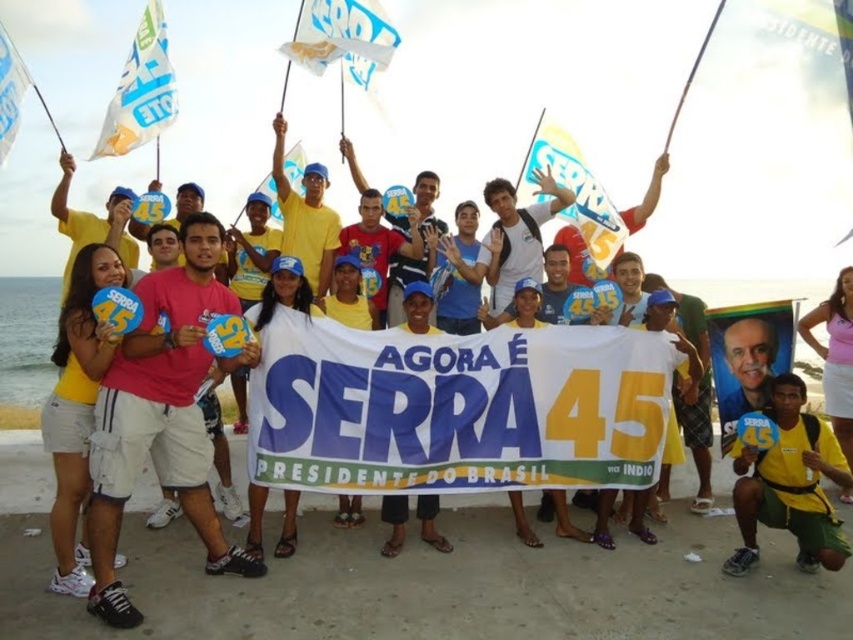
Can you confirm if yellow fabric shirt at center is thinner than white paper flag at upper left?

Incorrect, yellow fabric shirt at center's width is not less than white paper flag at upper left's.

Measure the distance between yellow fabric shirt at center and camera.

yellow fabric shirt at center and camera are 6.58 meters apart from each other.

Locate an element on the screen. Image resolution: width=853 pixels, height=640 pixels. yellow fabric shirt at center is located at coordinates (790, 483).

The width and height of the screenshot is (853, 640). Describe the element at coordinates (790, 483) in the screenshot. I see `yellow fabric shirt at center` at that location.

Which of these two, yellow fabric shirt at center or yellow fabric flag at center, stands shorter?

With less height is yellow fabric shirt at center.

Find the location of a particular element. yellow fabric shirt at center is located at coordinates (790, 483).

At what (x,y) coordinates should I click in order to perform the action: click on yellow fabric shirt at center. Please return your answer as a coordinate pair (x, y). Image resolution: width=853 pixels, height=640 pixels. Looking at the image, I should click on (790, 483).

Between pink fabric shirt at center and white paper flag at upper center, which one has more height?

With more height is white paper flag at upper center.

Is point (125, 388) farther from viewer compared to point (346, 42)?

No, (125, 388) is closer to viewer.

Does point (291, 278) come in front of point (279, 49)?

That is True.

Where is `pink fabric shirt at center`? The height and width of the screenshot is (640, 853). pink fabric shirt at center is located at coordinates (364, 433).